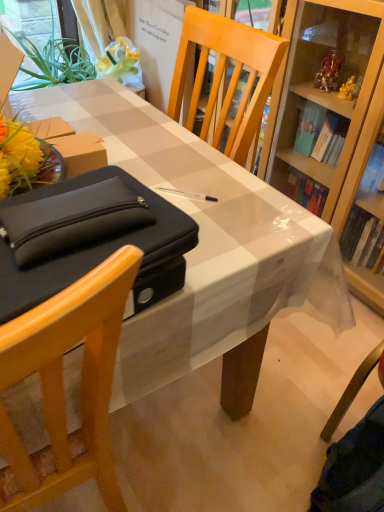
Find the location of `matte black bag at left`. matte black bag at left is located at coordinates (63, 386).

The width and height of the screenshot is (384, 512). Describe the element at coordinates (203, 239) in the screenshot. I see `white glossy desk at center` at that location.

In order to face black fabric pouch at left, should I rotate leftwards or rightwards?

Turn left approximately 15.058 degrees to face it.

Where is `matte black bag at left`? Image resolution: width=384 pixels, height=512 pixels. matte black bag at left is located at coordinates (63, 386).

Does matte black bag at left touch black fabric pouch at left?

No, matte black bag at left is not making contact with black fabric pouch at left.

Consider the image. Between matte black bag at left and black fabric pouch at left, which one has more height?

matte black bag at left.

Can you confirm if matte black bag at left is bigger than black fabric pouch at left?

Correct, matte black bag at left is larger in size than black fabric pouch at left.

From the image's perspective, is matte black bag at left on top of white glossy desk at center?

No, from the image's perspective, matte black bag at left is not over white glossy desk at center.

Can you confirm if matte black bag at left is wider than white glossy desk at center?

Yes, matte black bag at left is wider than white glossy desk at center.

Measure the distance between matte black bag at left and white glossy desk at center.

matte black bag at left is 17.27 inches from white glossy desk at center.

From a real-world perspective, is matte black bag at left on top of white glossy desk at center?

No.

Does black fabric pouch at left touch white glossy desk at center?

No.

Which is in front, black fabric pouch at left or white glossy desk at center?

black fabric pouch at left is closer to the camera.

Where is `box below the white glossy desk at center (from the image's perspective)`? The height and width of the screenshot is (512, 384). box below the white glossy desk at center (from the image's perspective) is located at coordinates (89, 238).

Which of these two, black fabric pouch at left or white glossy desk at center, is wider?

Wider between the two is white glossy desk at center.

Considering their positions, is white glossy desk at center located in front of or behind matte black bag at left?

In the image, white glossy desk at center appears behind matte black bag at left.

Based on the photo, is white glossy desk at center aimed at matte black bag at left?

No, white glossy desk at center is not aimed at matte black bag at left.

From the picture: In terms of size, does white glossy desk at center appear bigger or smaller than matte black bag at left?

white glossy desk at center is bigger than matte black bag at left.

Is white glossy desk at center at the left side of matte black bag at left?

Incorrect, white glossy desk at center is not on the left side of matte black bag at left.

Consider the image. Would you say black fabric pouch at left is part of white glossy desk at center's contents?

No, black fabric pouch at left is located outside of white glossy desk at center.

Is white glossy desk at center oriented towards black fabric pouch at left?

No, white glossy desk at center is not turned towards black fabric pouch at left.

From a real-world perspective, which is physically above, white glossy desk at center or black fabric pouch at left?

black fabric pouch at left.

Which is further, [123,202] or [77,290]?

The point [123,202] is more distant.

Find the location of `box on the right of matte black bag at left`. box on the right of matte black bag at left is located at coordinates (89, 238).

From the picture: Which object is positioned more to the left, black fabric pouch at left or matte black bag at left?

From the viewer's perspective, matte black bag at left appears more on the left side.

You are a GUI agent. You are given a task and a screenshot of the screen. Output one action in this format:
    pyautogui.click(x=<x>, y=<y>)
    Task: Click on the chair located on the left of black fabric pouch at left
    This screenshot has height=512, width=384.
    Given the screenshot: What is the action you would take?
    pyautogui.click(x=63, y=386)

This screenshot has height=512, width=384. I want to click on chair below the white glossy desk at center (from a real-world perspective), so click(63, 386).

Based on their spatial positions, is black fabric pouch at left or white glossy desk at center closer to matte black bag at left?

black fabric pouch at left is positioned closer to the anchor matte black bag at left.

From the image, which object appears to be farther from white glossy desk at center, matte black bag at left or black fabric pouch at left?

Based on the image, matte black bag at left appears to be further to white glossy desk at center.

Looking at the image, which one is located closer to matte black bag at left, white glossy desk at center or black fabric pouch at left?

black fabric pouch at left.

Based on their spatial positions, is black fabric pouch at left or matte black bag at left further from white glossy desk at center?

The object further to white glossy desk at center is matte black bag at left.

Considering their positions, is white glossy desk at center positioned further to black fabric pouch at left than matte black bag at left?

white glossy desk at center is positioned further to the anchor black fabric pouch at left.

Based on the photo, from the image, which object appears to be farther from black fabric pouch at left, matte black bag at left or white glossy desk at center?

white glossy desk at center is positioned further to the anchor black fabric pouch at left.

The image size is (384, 512). What are the coordinates of `box between matte black bag at left and white glossy desk at center in the front-back direction` in the screenshot? It's located at (89, 238).